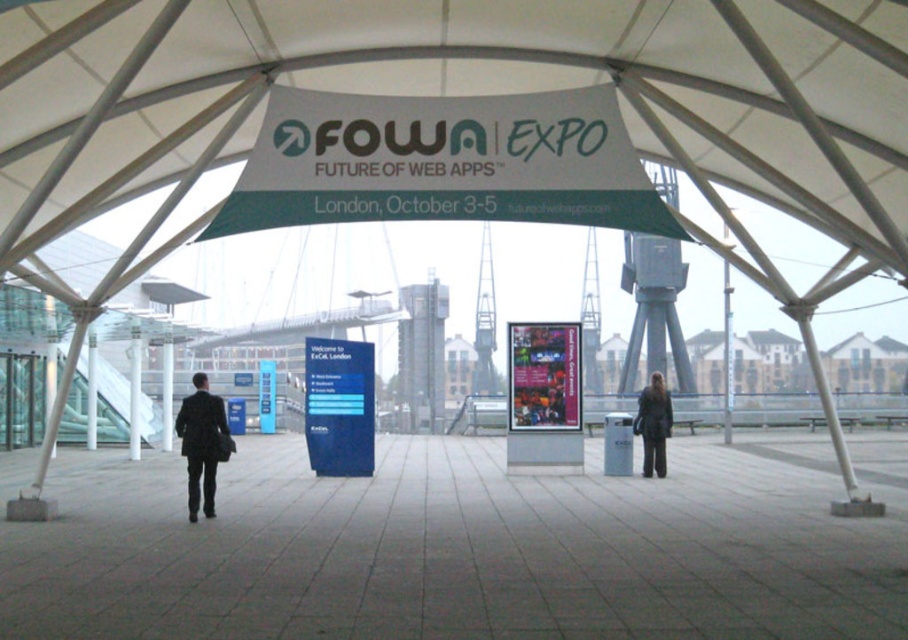
Measure the distance between matte plastic poster at center and camera.

The distance of matte plastic poster at center from camera is 17.02 meters.

Does matte plastic poster at center appear over dark gray suit at left?

Yes, matte plastic poster at center is above dark gray suit at left.

Between point (515, 323) and point (208, 440), which one is positioned in front?

Point (208, 440)

Where is `matte plastic poster at center`? Image resolution: width=908 pixels, height=640 pixels. matte plastic poster at center is located at coordinates (544, 376).

Is white fabric canopy at center to the right of dark gray suit at left from the viewer's perspective?

Indeed, white fabric canopy at center is positioned on the right side of dark gray suit at left.

Does white fabric canopy at center have a lesser width compared to dark gray suit at left?

No, white fabric canopy at center is not thinner than dark gray suit at left.

Does point (717, 157) come closer to viewer compared to point (191, 429)?

That is False.

Find the location of `white fabric canopy at center`. white fabric canopy at center is located at coordinates (465, 92).

Is dark gray suit at left closer to camera compared to white concrete pillar at left?

Yes, it is.

Between dark gray suit at left and white concrete pillar at left, which one appears on the right side from the viewer's perspective?

Positioned to the right is dark gray suit at left.

Who is more forward, (202, 454) or (87, 420)?

Point (202, 454) is in front.

The width and height of the screenshot is (908, 640). In order to click on dark gray suit at left in this screenshot , I will do `click(202, 444)`.